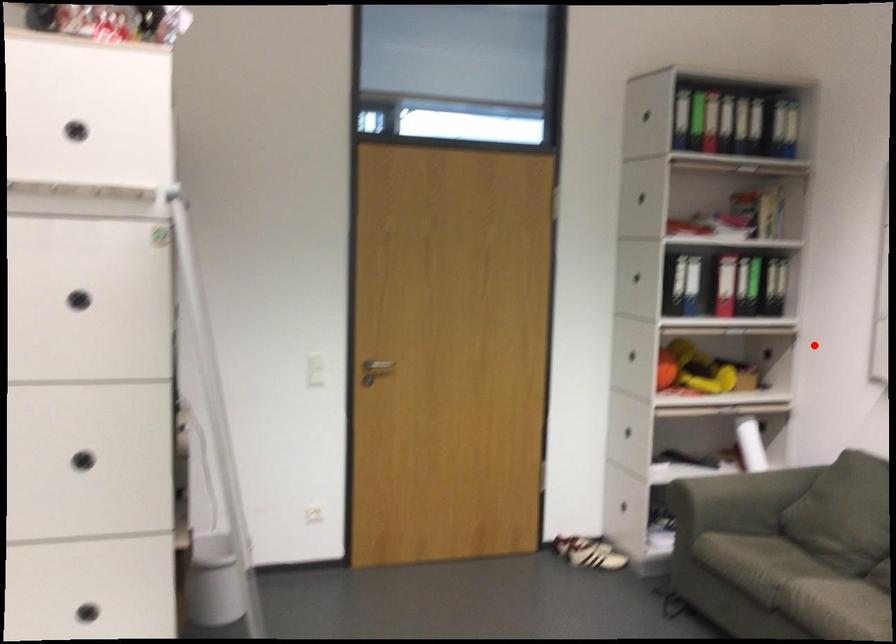
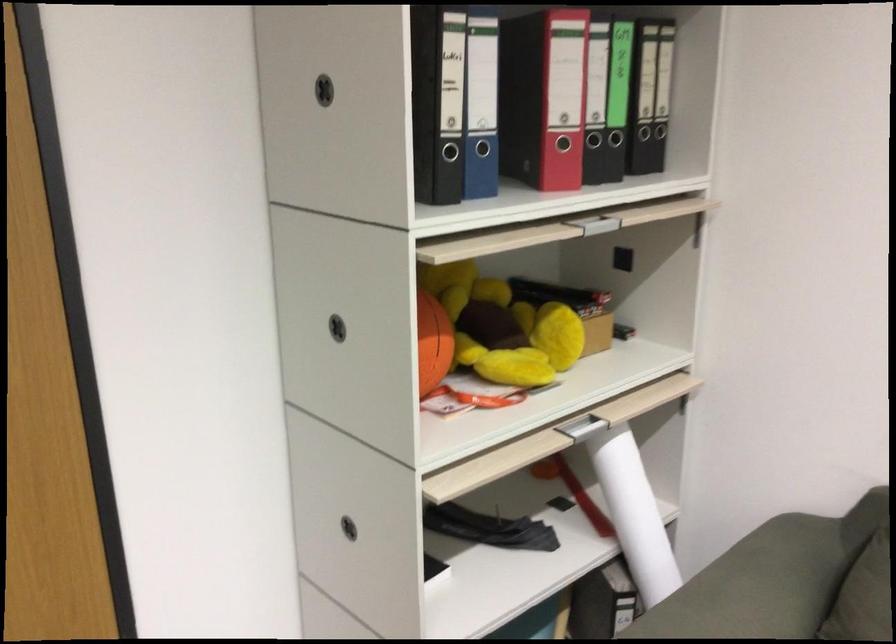
Question: I am providing you with two images of the same scene from different viewpoints. Image1 has a red point marked. In image2, the corresponding 3D location appears at what relative position? Reply with the corresponding letter.

Choices:
 (A) Closer
 (B) Farther

Answer: (A)